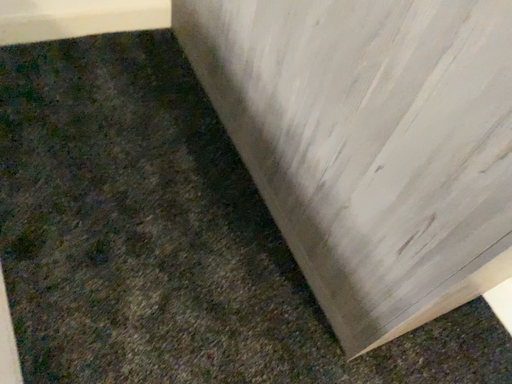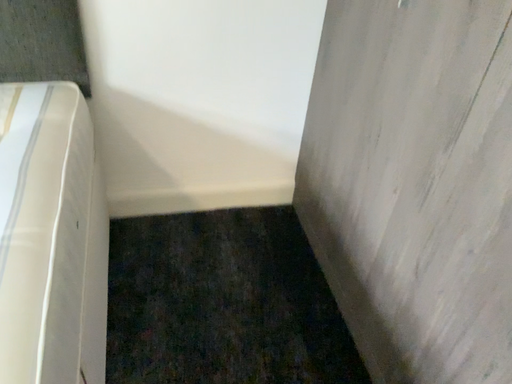
Question: Which way did the camera rotate in the video?

Choices:
 (A) rotated left
 (B) rotated right

Answer: (A)